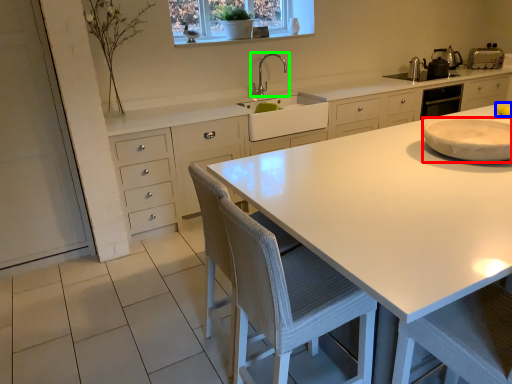
Question: Which object is the closest to the appliance (highlighted by a red box)? Choose among these: food (highlighted by a blue box) or tap (highlighted by a green box).

Choices:
 (A) food
 (B) tap

Answer: (A)